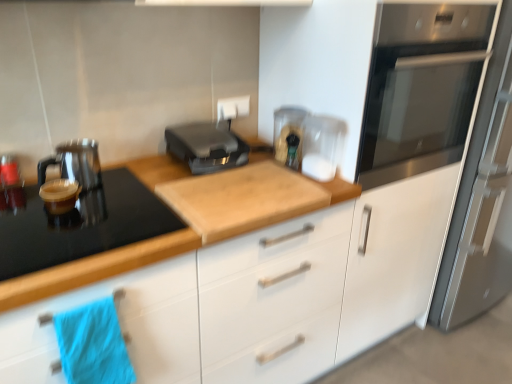
This screenshot has height=384, width=512. I want to click on free space in front of matte black kettle at left, which is the 2th kitchen appliance in right-to-left order, so click(55, 224).